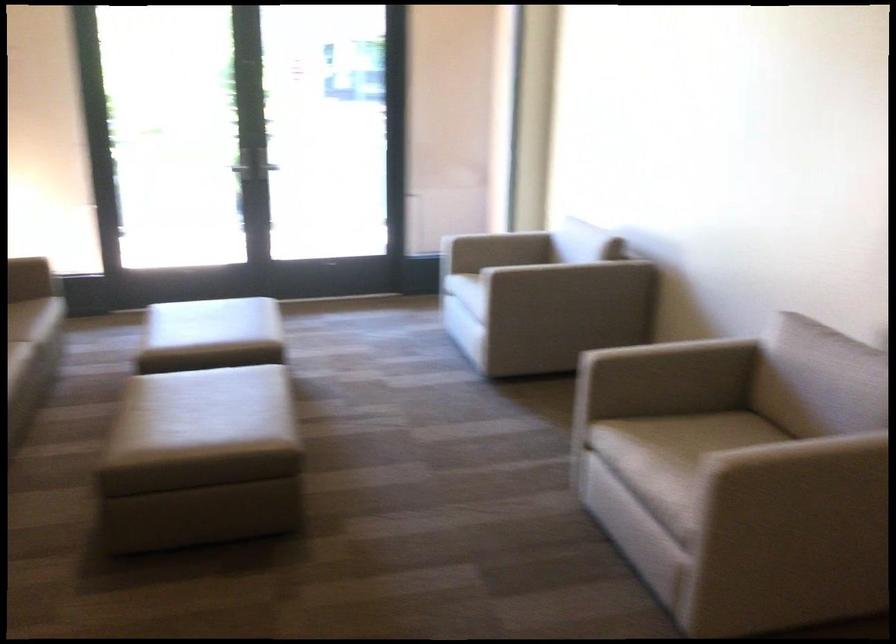
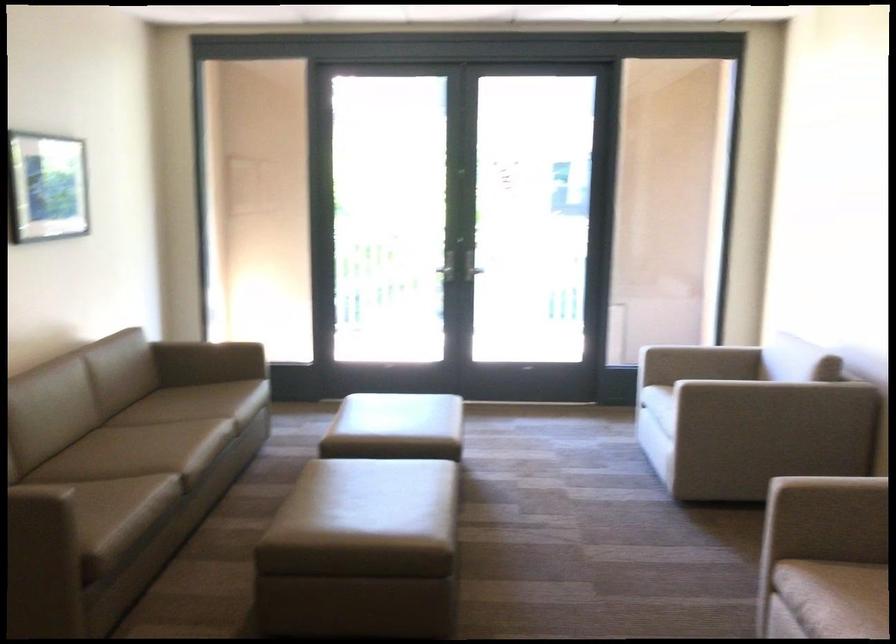
Question: I am providing you with two images of the same scene from different viewpoints. Please identify which objects are invisible in image2.

Choices:
 (A) brown sofa sitting surface
 (B) beige chair sitting surface
 (C) beige chair armrest
 (D) none of these

Answer: (D)